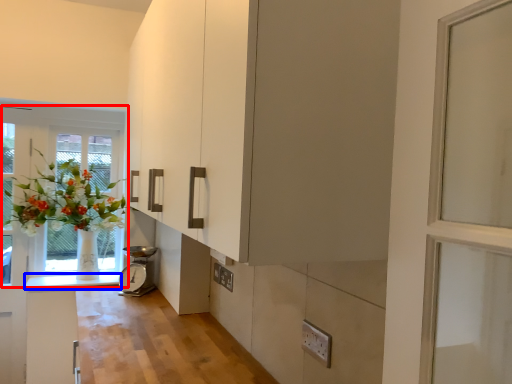
Question: Which point is closer to the camera, window (highlighted by a red box) or counter top (highlighted by a blue box)?

Choices:
 (A) window
 (B) counter top

Answer: (A)